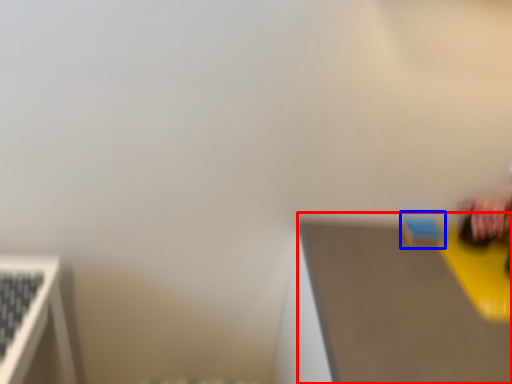
Question: Which of the following is the farthest to the observer, table top (highlighted by a red box) or toy (highlighted by a blue box)?

Choices:
 (A) table top
 (B) toy

Answer: (B)